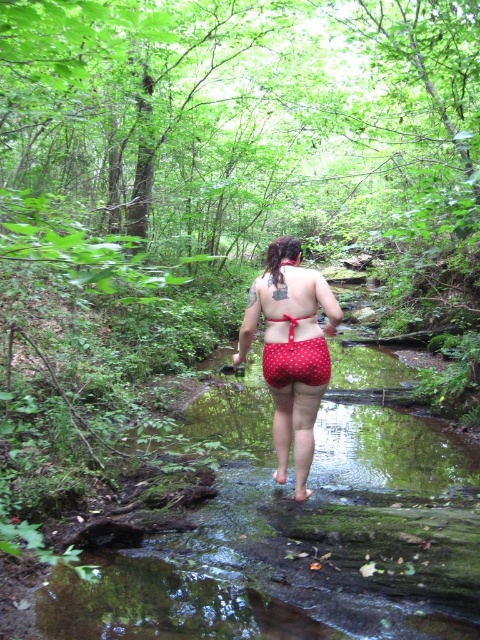
Which of these two, red polka dot shorts at center or red dotted fabric at center, stands shorter?

red dotted fabric at center is shorter.

Between red polka dot shorts at center and red dotted fabric at center, which one is positioned lower?

Positioned lower is red polka dot shorts at center.

Which is in front, point (286, 458) or point (276, 360)?

Point (276, 360) is in front.

Find the location of a particular element. This screenshot has height=640, width=480. red polka dot shorts at center is located at coordinates (290, 352).

Which is below, red polka dot shorts at center or red polka dot bikini top at center?

Positioned lower is red polka dot shorts at center.

Who is positioned more to the left, red polka dot shorts at center or red polka dot bikini top at center?

Positioned to the left is red polka dot shorts at center.

At what (x,y) coordinates should I click in order to perform the action: click on red polka dot shorts at center. Please return your answer as a coordinate pair (x, y). Looking at the image, I should click on (290, 352).

Does red dotted fabric at center have a lesser height compared to red polka dot bikini top at center?

No.

Is red dotted fabric at center smaller than red polka dot bikini top at center?

Actually, red dotted fabric at center might be larger than red polka dot bikini top at center.

Where is `red dotted fabric at center`? Image resolution: width=480 pixels, height=640 pixels. red dotted fabric at center is located at coordinates (297, 362).

You are a GUI agent. You are given a task and a screenshot of the screen. Output one action in this format:
    pyautogui.click(x=<x>, y=<y>)
    Task: Click on the red dotted fabric at center
    
    Given the screenshot: What is the action you would take?
    pyautogui.click(x=297, y=362)